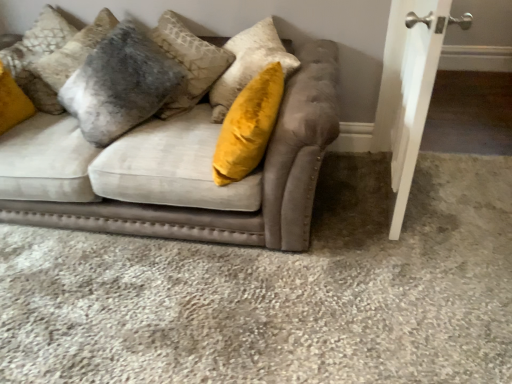
Question: Considering the positions of velvet gray pillow at upper left and white smooth door at right in the image, is velvet gray pillow at upper left bigger or smaller than white smooth door at right?

Choices:
 (A) small
 (B) big

Answer: (B)

Question: From the image's perspective, is velvet gray pillow at upper left positioned above or below white smooth door at right?

Choices:
 (A) above
 (B) below

Answer: (A)

Question: Based on their relative distances, which object is nearer to the velvet beige couch at center?

Choices:
 (A) velvet gray pillow at upper left
 (B) white smooth door at right

Answer: (A)

Question: Which object is the farthest from the velvet gray pillow at upper left?

Choices:
 (A) velvet beige couch at center
 (B) white smooth door at right

Answer: (B)